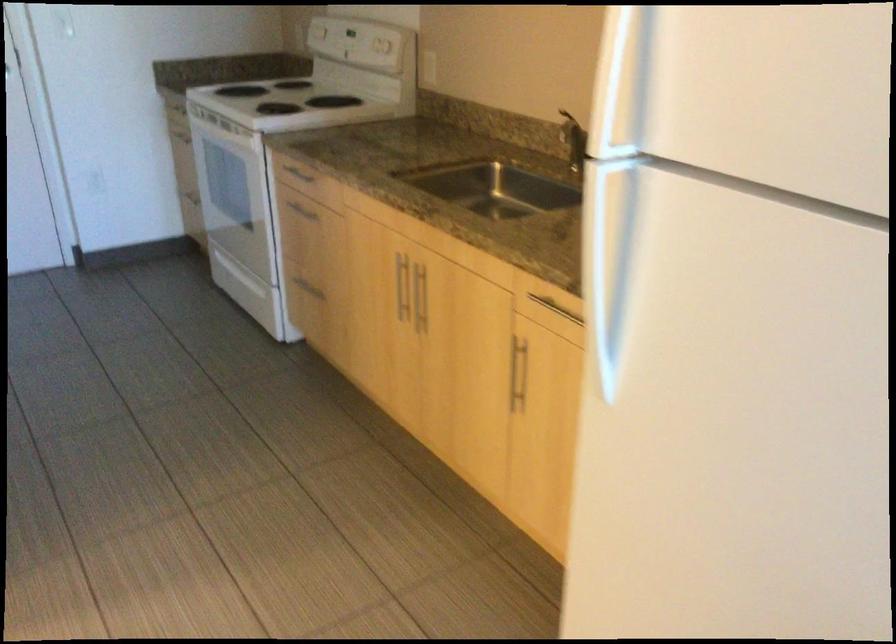
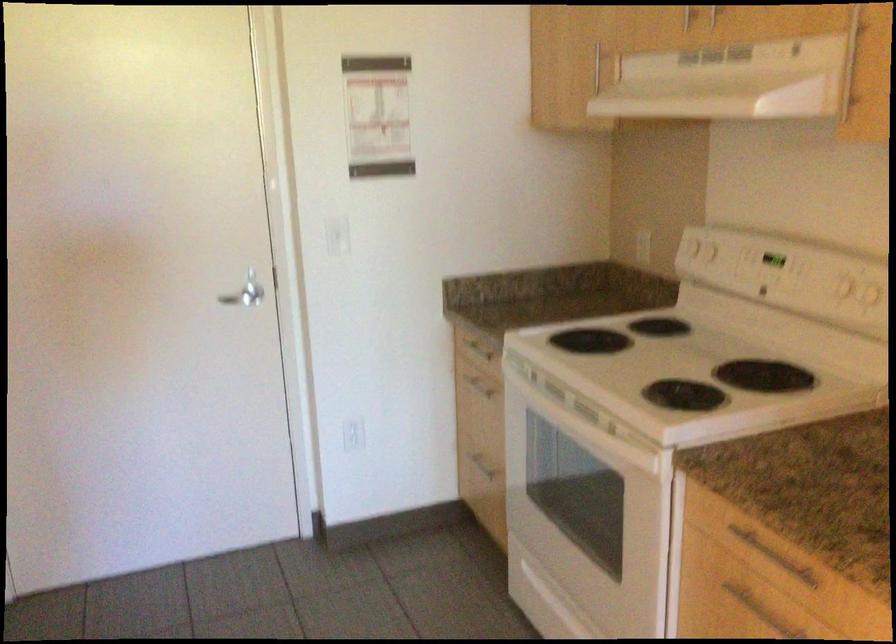
What movement of the cameraman would produce the second image?

The movement direction of the cameraman is left, forward.